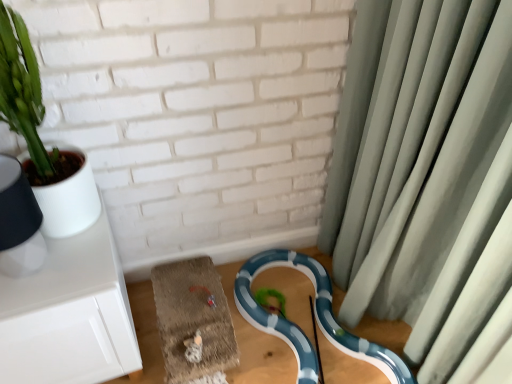
Question: Considering the relative positions of green matte plant at upper left and green fabric curtain at right in the image provided, is green matte plant at upper left in front of green fabric curtain at right?

Choices:
 (A) yes
 (B) no

Answer: (B)

Question: From the image's perspective, is green matte plant at upper left below green fabric curtain at right?

Choices:
 (A) no
 (B) yes

Answer: (A)

Question: Does green matte plant at upper left have a smaller size compared to green fabric curtain at right?

Choices:
 (A) no
 (B) yes

Answer: (B)

Question: Is green matte plant at upper left to the right of green fabric curtain at right from the viewer's perspective?

Choices:
 (A) yes
 (B) no

Answer: (B)

Question: Is green matte plant at upper left positioned beyond the bounds of green fabric curtain at right?

Choices:
 (A) no
 (B) yes

Answer: (B)

Question: In the image, is green fabric curtain at right positioned in front of or behind green matte plant at upper left?

Choices:
 (A) behind
 (B) front

Answer: (B)

Question: Is green fabric curtain at right spatially inside green matte plant at upper left, or outside of it?

Choices:
 (A) inside
 (B) outside

Answer: (B)

Question: Considering the relative positions of green fabric curtain at right and green matte plant at upper left in the image provided, is green fabric curtain at right to the left or to the right of green matte plant at upper left?

Choices:
 (A) right
 (B) left

Answer: (A)

Question: In terms of height, does green fabric curtain at right look taller or shorter compared to green matte plant at upper left?

Choices:
 (A) short
 (B) tall

Answer: (B)

Question: From a real-world perspective, is green matte plant at upper left positioned above or below blue glossy snake at lower center?

Choices:
 (A) above
 (B) below

Answer: (A)

Question: Visually, is green matte plant at upper left positioned to the left or to the right of blue glossy snake at lower center?

Choices:
 (A) right
 (B) left

Answer: (B)

Question: Considering the positions of green matte plant at upper left and blue glossy snake at lower center in the image, is green matte plant at upper left wider or thinner than blue glossy snake at lower center?

Choices:
 (A) wide
 (B) thin

Answer: (B)

Question: Is green matte plant at upper left in front of or behind blue glossy snake at lower center in the image?

Choices:
 (A) behind
 (B) front

Answer: (B)

Question: Is green matte plant at upper left bigger or smaller than green fabric curtain at right?

Choices:
 (A) small
 (B) big

Answer: (A)

Question: From the image's perspective, relative to green fabric curtain at right, is green matte plant at upper left above or below?

Choices:
 (A) above
 (B) below

Answer: (A)